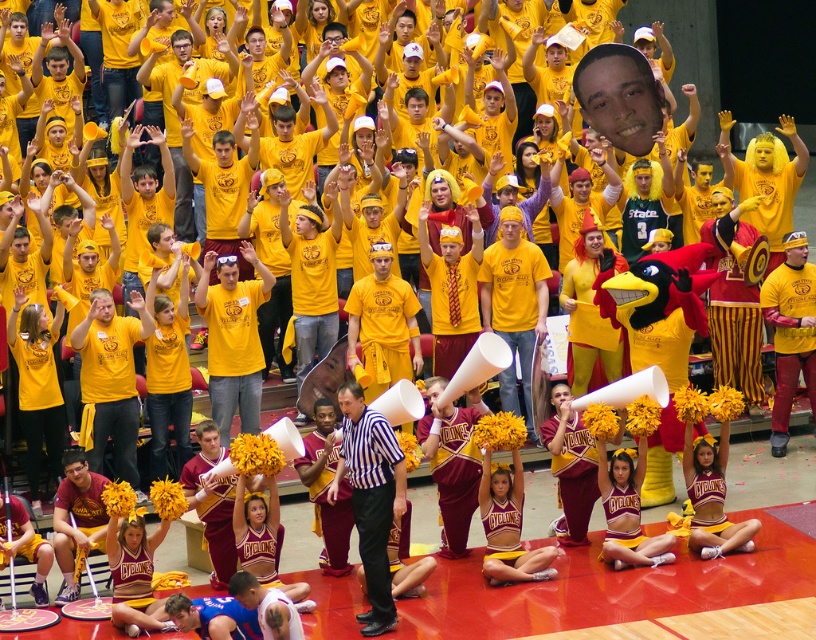
Question: Can you confirm if black striped shirt at center is positioned above maroon jersey at lower left?

Choices:
 (A) no
 (B) yes

Answer: (B)

Question: Based on their relative distances, which object is farther from the black striped shirt at center?

Choices:
 (A) blue jersey at lower center
 (B) maroon jersey at lower left

Answer: (B)

Question: Is maroon jersey at lower left to the left of blue jersey at lower center from the viewer's perspective?

Choices:
 (A) no
 (B) yes

Answer: (B)

Question: Which point is farther to the camera?

Choices:
 (A) yellow jersey at center
 (B) blue jersey at lower center
 (C) black striped shirt at center
 (D) maroon jersey at lower left

Answer: (A)

Question: Which point is closer to the camera?

Choices:
 (A) (229, 577)
 (B) (78, 502)

Answer: (A)

Question: Is black striped shirt at center behind maroon jersey at lower left?

Choices:
 (A) no
 (B) yes

Answer: (A)